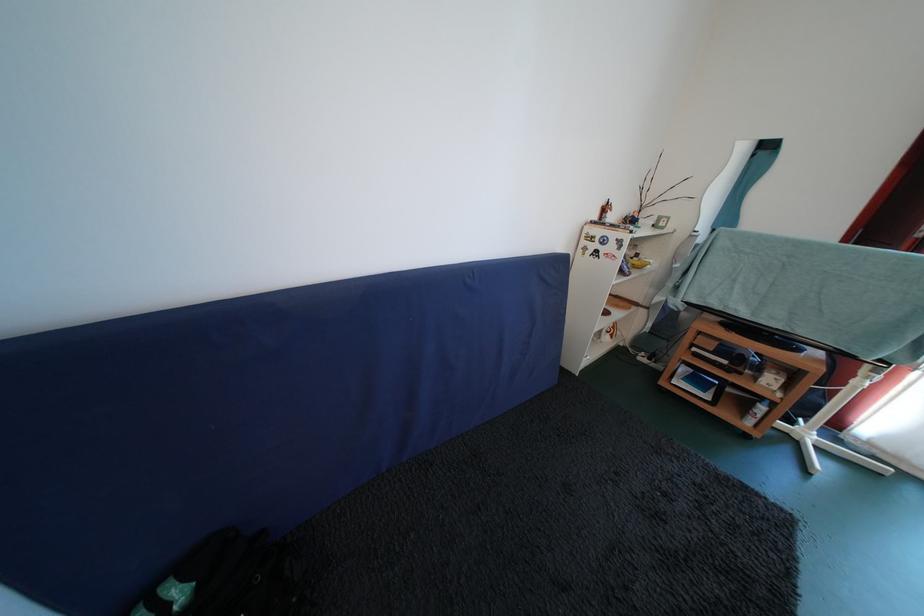
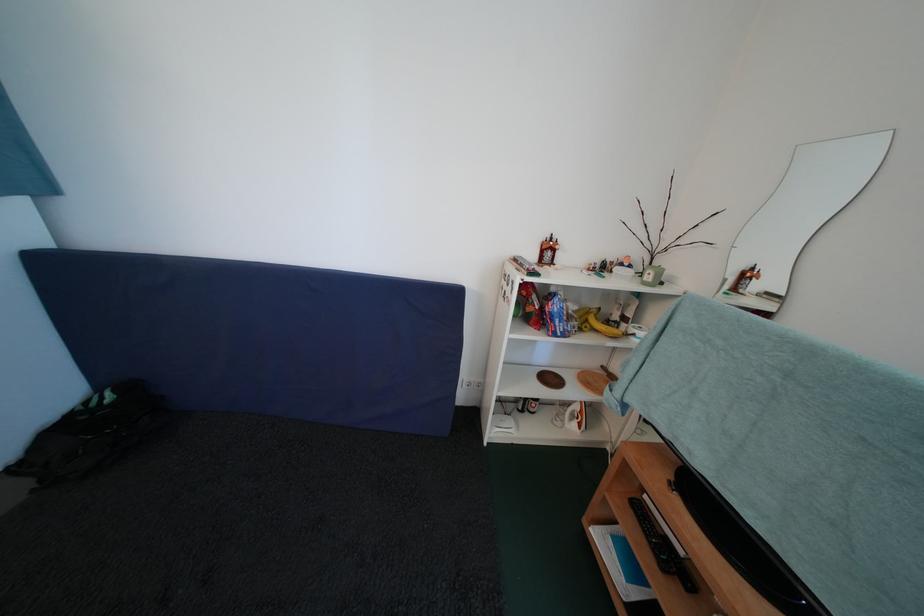
The point at (x=603, y=224) is marked in the first image. Where is the corresponding point in the second image?

(539, 261)